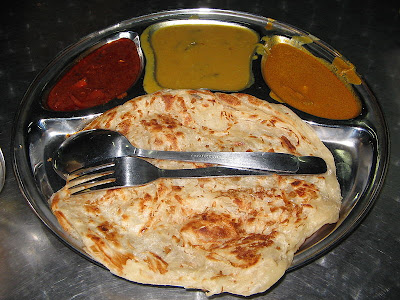
Locate an element on the screen. The image size is (400, 300). light reflection on table is located at coordinates (36, 239).